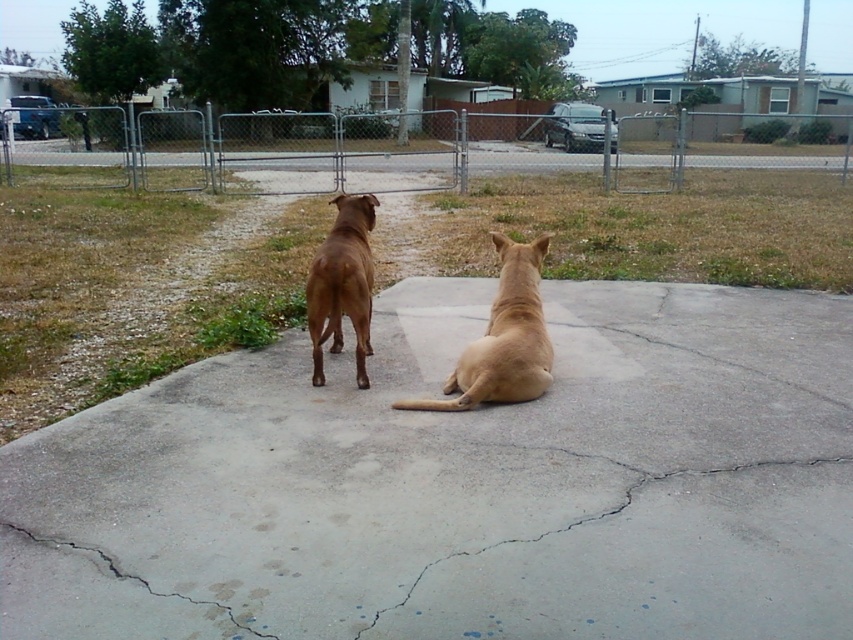
You are a dog owner trying to decide if the gray concrete crack at center is long enough to hide a small treat. The light brown fur at center might be in the way. Is the crack longer than the fur?

The gray concrete crack at center is shorter than light brown fur at center, so the crack is not long enough to hide the treat under the fur.

You are standing at the chain link fence in the background of the scene. You see two points marked on the concrete surface where the dogs are sitting. Which point, point [769,609] or point [310,115], is closer to you?

Point [769,609] is in front of point [310,115], so it is closer to you.

You are a dog owner who wants to walk your brown glossy dog at center across the gray concrete crack at center. Considering their size, will the crack be a problem for the dog to step over?

The gray concrete crack at center is wider than the brown glossy dog at center, so it might be challenging for the dog to step over safely. The crack is wider than the dog, so it may require caution or an alternative path.